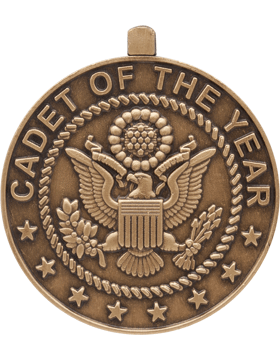
At what (x,y) coordinates should I click in order to perform the action: click on decoration. Please return your answer as a coordinate pair (x, y). Looking at the image, I should click on (143, 115).